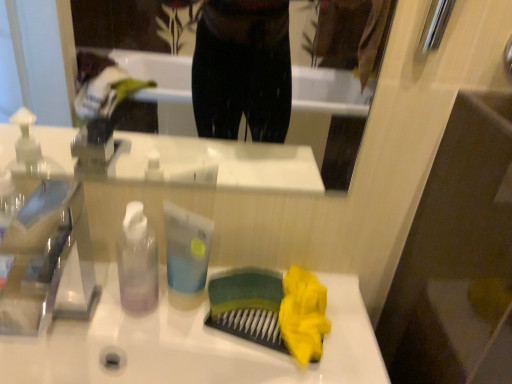
The image size is (512, 384). Identify the location of transparent plastic faucet at left. (48, 261).

Find the location of `transparent plastic faucet at left`. transparent plastic faucet at left is located at coordinates (x=48, y=261).

Is transparent plastic bottle at center spatially inside transparent plastic faucet at left, or outside of it?

transparent plastic bottle at center cannot be found inside transparent plastic faucet at left.

Looking at this image, from the image's perspective, which one is positioned lower, transparent plastic bottle at center or transparent plastic faucet at left?

From the image's view, transparent plastic faucet at left is below.

Is transparent plastic faucet at left at the back of transparent plastic bottle at center?

That's not correct — transparent plastic bottle at center is not looking away from transparent plastic faucet at left.

How many degrees apart are the facing directions of translucent plastic bottle at center and transparent plastic faucet at left?

The angular difference between translucent plastic bottle at center and transparent plastic faucet at left is 4.03 degrees.

Is translucent plastic bottle at center positioned behind transparent plastic faucet at left?

Yes, it is behind transparent plastic faucet at left.

Can you confirm if translucent plastic bottle at center is bigger than transparent plastic faucet at left?

Actually, translucent plastic bottle at center might be smaller than transparent plastic faucet at left.

Does translucent plastic bottle at center turn towards transparent plastic faucet at left?

No, translucent plastic bottle at center is not aimed at transparent plastic faucet at left.

How distant is transparent plastic faucet at left from transparent plastic bottle at center?

transparent plastic faucet at left and transparent plastic bottle at center are 8.27 inches apart.

The width and height of the screenshot is (512, 384). I want to click on faucet below the transparent plastic bottle at center (from a real-world perspective), so click(48, 261).

Which point is more forward, (28, 211) or (147, 237)?

The point (147, 237) is closer.

From the image's perspective, relative to transparent plastic bottle at center, is transparent plastic faucet at left above or below?

transparent plastic faucet at left is situated lower than transparent plastic bottle at center in the image.

From a real-world perspective, relative to translucent plastic bottle at center, is transparent plastic bottle at center vertically above or below?

In terms of real-world spatial position, transparent plastic bottle at center is above translucent plastic bottle at center.

Between point (141, 229) and point (170, 248), which one is positioned in front?

Positioned in front is point (141, 229).

Does transparent plastic bottle at center contain translucent plastic bottle at center?

No, transparent plastic bottle at center does not contain translucent plastic bottle at center.

How distant is translucent plastic bottle at center from transparent plastic bottle at center?

translucent plastic bottle at center and transparent plastic bottle at center are 1.97 inches apart from each other.

Between translucent plastic bottle at center and transparent plastic bottle at center, which one has more height?

transparent plastic bottle at center.

Is transparent plastic bottle at center at the back of translucent plastic bottle at center?

translucent plastic bottle at center is not turned away from transparent plastic bottle at center.

Between translucent plastic bottle at center and transparent plastic bottle at center, which one appears on the left side from the viewer's perspective?

transparent plastic bottle at center is more to the left.

Which object is closer to the camera taking this photo, transparent plastic faucet at left or translucent plastic bottle at center?

Result: transparent plastic faucet at left is closer to the camera.

Between transparent plastic faucet at left and translucent plastic bottle at center, which one has smaller size?

translucent plastic bottle at center.

From a real-world perspective, between transparent plastic faucet at left and translucent plastic bottle at center, who is vertically lower?

translucent plastic bottle at center.

I want to click on faucet in front of the transparent plastic bottle at center, so click(48, 261).

Where is `toiletry that appears below the transparent plastic faucet at left (from the image's perspective)`? The image size is (512, 384). toiletry that appears below the transparent plastic faucet at left (from the image's perspective) is located at coordinates (186, 255).

Looking at the image, which one is located closer to transparent plastic faucet at left, transparent plastic bottle at center or translucent plastic bottle at center?

Based on the image, transparent plastic bottle at center appears to be nearer to transparent plastic faucet at left.

Estimate the real-world distances between objects in this image. Which object is further from transparent plastic faucet at left, translucent plastic bottle at center or transparent plastic bottle at center?

translucent plastic bottle at center is further to transparent plastic faucet at left.

Considering their positions, is transparent plastic faucet at left positioned closer to transparent plastic bottle at center than translucent plastic bottle at center?

translucent plastic bottle at center is closer to transparent plastic bottle at center.

Looking at this image, from the image, which object appears to be farther from transparent plastic bottle at center, translucent plastic bottle at center or transparent plastic faucet at left?

The object further to transparent plastic bottle at center is transparent plastic faucet at left.

Based on their spatial positions, is transparent plastic bottle at center or transparent plastic faucet at left further from translucent plastic bottle at center?

transparent plastic faucet at left is positioned further to the anchor translucent plastic bottle at center.

Estimate the real-world distances between objects in this image. Which object is closer to translucent plastic bottle at center, transparent plastic faucet at left or transparent plastic bottle at center?

transparent plastic bottle at center is positioned closer to the anchor translucent plastic bottle at center.

Identify the location of bottle located between transparent plastic faucet at left and translucent plastic bottle at center in the depth direction. (137, 261).